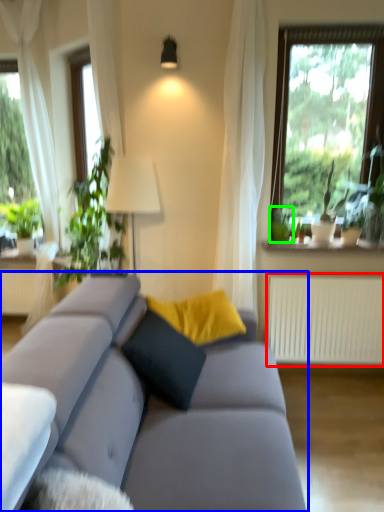
Question: Which object is positioned farthest from radiator (highlighted by a red box)? Select from studio couch (highlighted by a blue box) and plant (highlighted by a green box).

Choices:
 (A) studio couch
 (B) plant

Answer: (A)